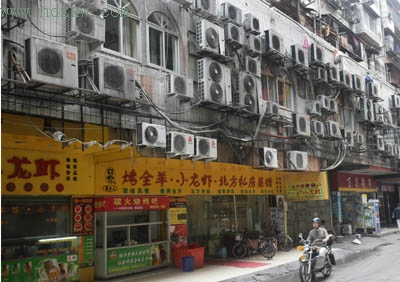
Identify the location of fan. This screenshot has height=282, width=400. (155, 140).